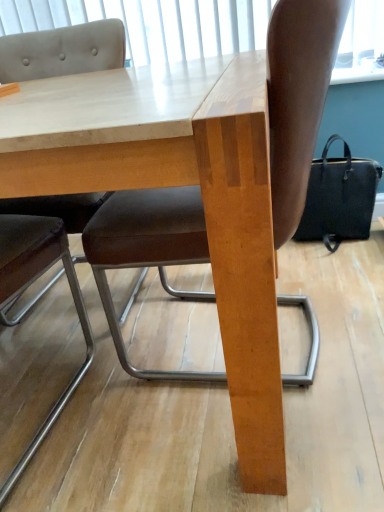
Question: Can you confirm if brown leather chair at center, arranged as the second chair when viewed from the left, is wider than black fabric bag at right?

Choices:
 (A) no
 (B) yes

Answer: (B)

Question: Is brown leather chair at center, the 1th chair positioned from the right, positioned beyond the bounds of black fabric bag at right?

Choices:
 (A) no
 (B) yes

Answer: (B)

Question: From the image's perspective, does brown leather chair at center, arranged as the second chair when viewed from the left, appear lower than black fabric bag at right?

Choices:
 (A) yes
 (B) no

Answer: (A)

Question: Does brown leather chair at center, the 1th chair positioned from the right, appear on the right side of black fabric bag at right?

Choices:
 (A) no
 (B) yes

Answer: (A)

Question: Is black fabric bag at right inside brown leather chair at center, arranged as the second chair when viewed from the left?

Choices:
 (A) yes
 (B) no

Answer: (B)

Question: Considering the positions of wooden table at center and black fabric bag at right in the image, is wooden table at center wider or thinner than black fabric bag at right?

Choices:
 (A) thin
 (B) wide

Answer: (B)

Question: Considering the positions of wooden table at center and black fabric bag at right in the image, is wooden table at center bigger or smaller than black fabric bag at right?

Choices:
 (A) small
 (B) big

Answer: (B)

Question: Relative to black fabric bag at right, is wooden table at center in front or behind?

Choices:
 (A) behind
 (B) front

Answer: (B)

Question: In the image, is wooden table at center on the left side or the right side of black fabric bag at right?

Choices:
 (A) right
 (B) left

Answer: (B)

Question: From the image's perspective, is brown leather chair at center, arranged as the second chair when viewed from the left, above or below brown leather chair at upper left, the 1th chair viewed from the left?

Choices:
 (A) below
 (B) above

Answer: (B)

Question: Considering the relative positions of brown leather chair at center, the 1th chair positioned from the right, and brown leather chair at upper left, the 1th chair viewed from the left, in the image provided, is brown leather chair at center, the 1th chair positioned from the right, to the left or to the right of brown leather chair at upper left, the 1th chair viewed from the left,?

Choices:
 (A) left
 (B) right

Answer: (B)

Question: From their relative heights in the image, would you say brown leather chair at center, arranged as the second chair when viewed from the left, is taller or shorter than brown leather chair at upper left, which is counted as the second chair, starting from the right?

Choices:
 (A) tall
 (B) short

Answer: (B)

Question: Does point 145,220 appear closer or farther from the camera than point 87,29?

Choices:
 (A) farther
 (B) closer

Answer: (B)

Question: From a real-world perspective, is black fabric bag at right physically located above or below wooden table at center?

Choices:
 (A) above
 (B) below

Answer: (B)

Question: In terms of height, does black fabric bag at right look taller or shorter compared to wooden table at center?

Choices:
 (A) short
 (B) tall

Answer: (A)